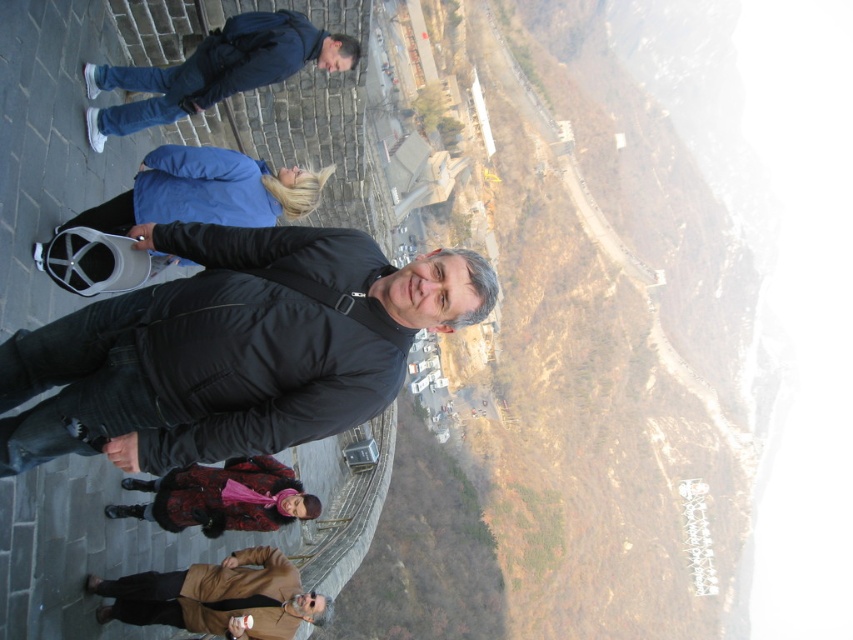
Does black matte jacket at center have a larger size compared to brown leather jacket at lower center?

Yes.

Between point (248, 324) and point (200, 593), which one is positioned behind?

Positioned behind is point (200, 593).

The image size is (853, 640). I want to click on black matte jacket at center, so click(x=231, y=348).

Between brown leather jacket at lower center and velvet-like red coat at center, which one appears on the right side from the viewer's perspective?

brown leather jacket at lower center

Is point (149, 579) less distant than point (241, 509)?

Yes, it is.

Locate an element on the screen. The height and width of the screenshot is (640, 853). brown leather jacket at lower center is located at coordinates (216, 596).

Does dark blue jacket at upper left have a greater width compared to velvet-like red coat at center?

Correct, the width of dark blue jacket at upper left exceeds that of velvet-like red coat at center.

Is dark blue jacket at upper left above velvet-like red coat at center?

Yes, dark blue jacket at upper left is above velvet-like red coat at center.

Between point (270, 17) and point (184, 490), which one is positioned in front?

Point (270, 17) is more forward.

Identify the location of dark blue jacket at upper left. This screenshot has width=853, height=640. (213, 70).